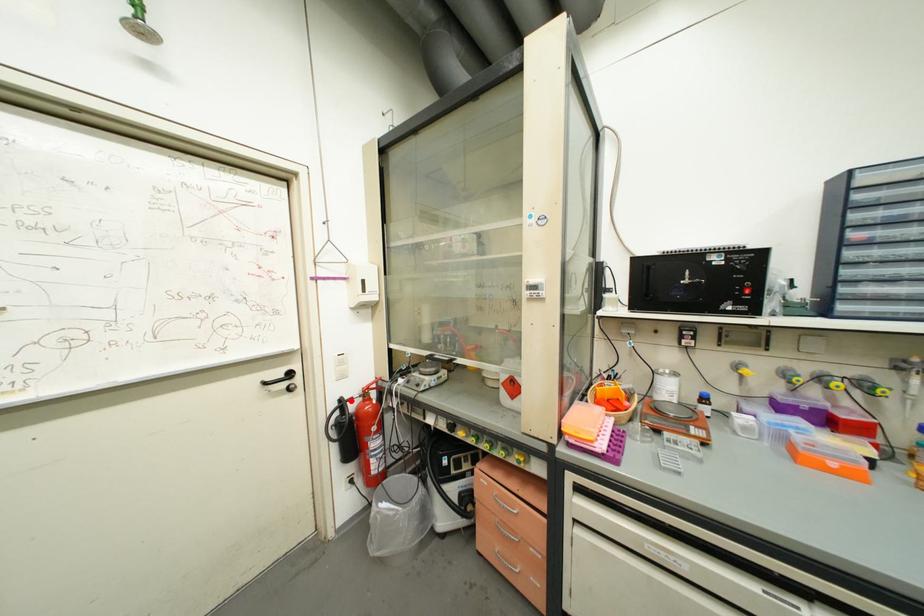
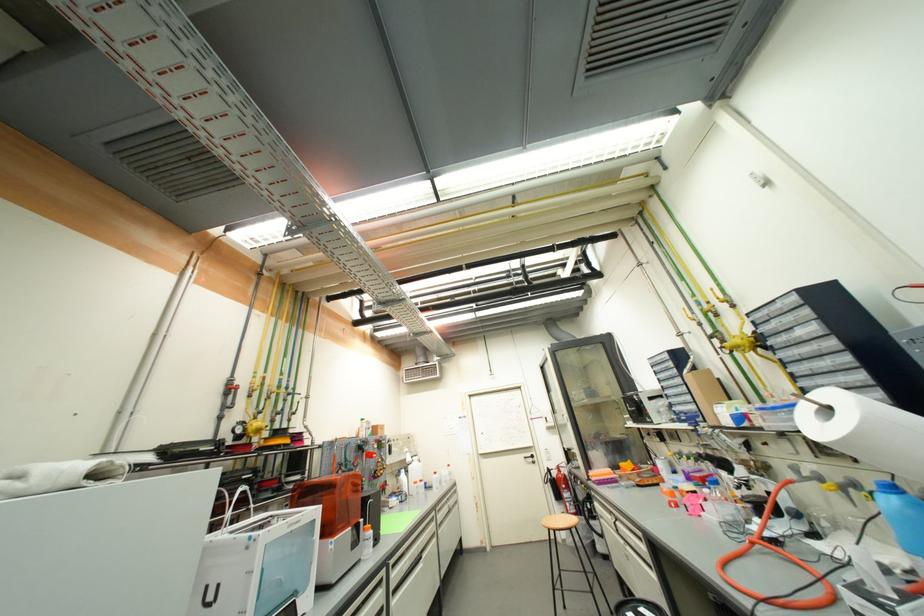
Question: I am providing you with two images of the same scene from different viewpoints. In image1, a red point is highlighted. Considering the same 3D point in image2, which of the following is correct?

Choices:
 (A) It is closer
 (B) It is farther

Answer: (B)